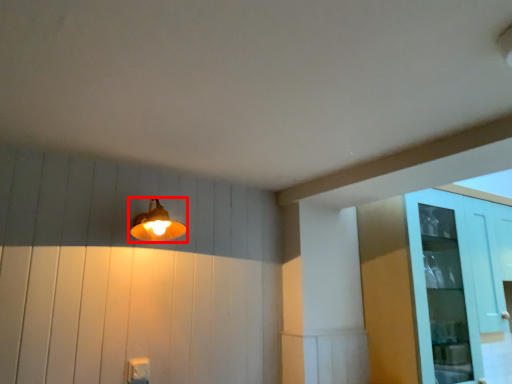
Question: From the image's perspective, what is the correct spatial positioning of lamp (annotated by the red box) in reference to glass door?

Choices:
 (A) below
 (B) above

Answer: (B)